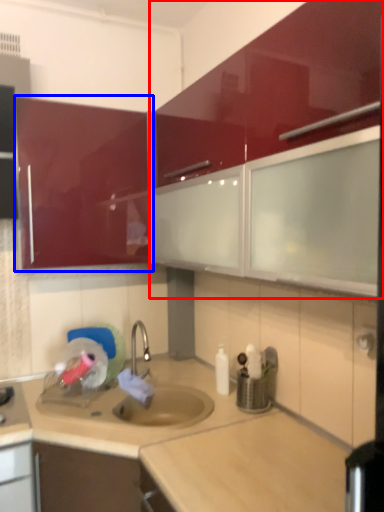
Question: Which object appears farthest to the camera in this image, cabinetry (highlighted by a red box) or cabinetry (highlighted by a blue box)?

Choices:
 (A) cabinetry
 (B) cabinetry

Answer: (B)